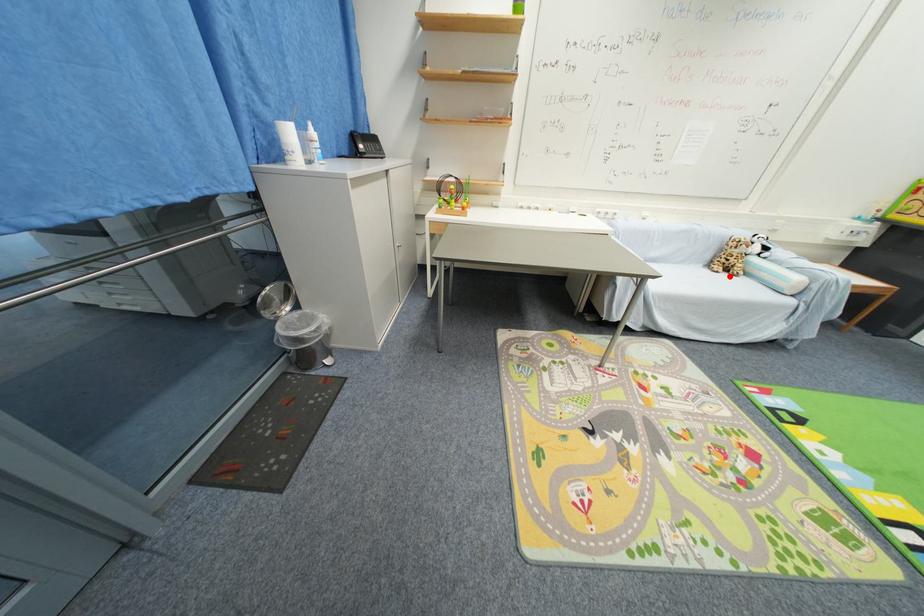
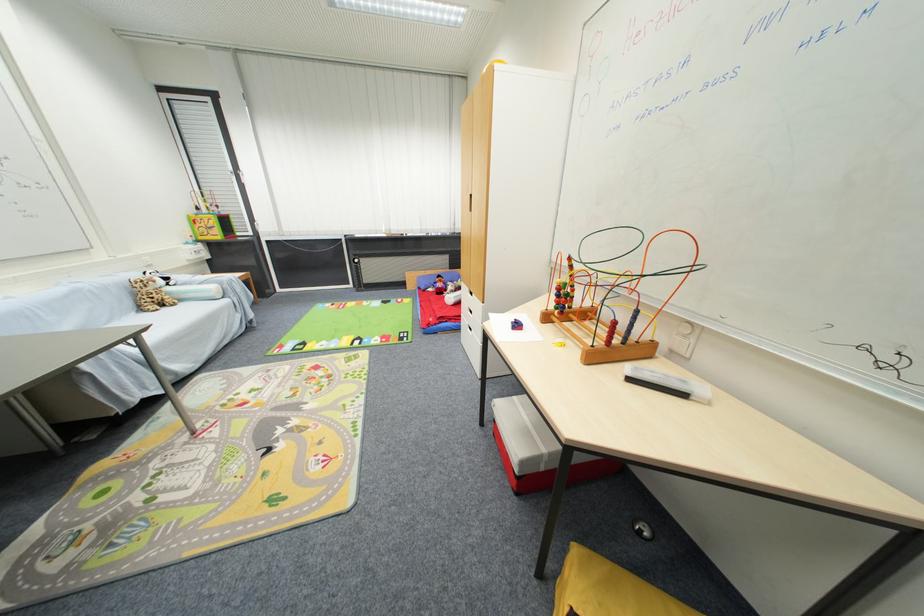
Find the pixel in the second image that matches the highlighted location in the first image.

(171, 310)